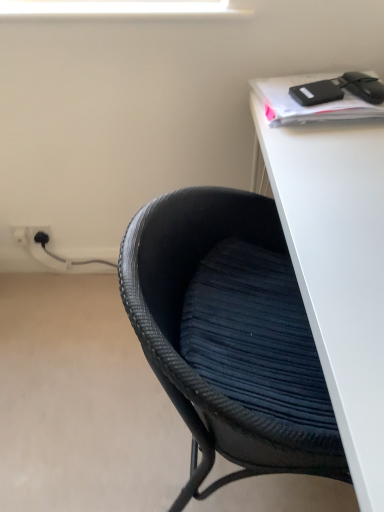
Question: Can you confirm if white plastic electric outlet at lower left, the 2th electric outlet when ordered from right to left, is shorter than white matte desk at upper right?

Choices:
 (A) no
 (B) yes

Answer: (B)

Question: Does white plastic electric outlet at lower left, the 2th electric outlet when ordered from right to left, have a smaller size compared to white matte desk at upper right?

Choices:
 (A) no
 (B) yes

Answer: (B)

Question: Is white plastic electric outlet at lower left, the 2th electric outlet when ordered from right to left, turned away from white matte desk at upper right?

Choices:
 (A) yes
 (B) no

Answer: (B)

Question: Is white plastic electric outlet at lower left, which ranks as the first electric outlet in left-to-right order, completely or partially outside of white matte desk at upper right?

Choices:
 (A) no
 (B) yes

Answer: (B)

Question: From a real-world perspective, is white plastic electric outlet at lower left, which ranks as the first electric outlet in left-to-right order, positioned over white matte desk at upper right based on gravity?

Choices:
 (A) no
 (B) yes

Answer: (A)

Question: Can you confirm if white plastic electric outlet at lower left, the 2th electric outlet when ordered from right to left, is positioned to the left of white matte desk at upper right?

Choices:
 (A) no
 (B) yes

Answer: (B)

Question: Does white plastic electric outlet at lower left, the 2th electric outlet when ordered from left to right, come behind white matte desk at upper right?

Choices:
 (A) no
 (B) yes

Answer: (B)

Question: Are white plastic electric outlet at lower left, which ranks as the first electric outlet in right-to-left order, and white matte desk at upper right beside each other?

Choices:
 (A) yes
 (B) no

Answer: (B)

Question: Is white plastic electric outlet at lower left, which ranks as the first electric outlet in right-to-left order, positioned beyond the bounds of white matte desk at upper right?

Choices:
 (A) no
 (B) yes

Answer: (B)

Question: From a real-world perspective, does white plastic electric outlet at lower left, which ranks as the first electric outlet in right-to-left order, stand above white matte desk at upper right?

Choices:
 (A) yes
 (B) no

Answer: (B)

Question: Does white plastic electric outlet at lower left, which ranks as the first electric outlet in right-to-left order, have a lesser width compared to white matte desk at upper right?

Choices:
 (A) no
 (B) yes

Answer: (B)

Question: Is white plastic electric outlet at lower left, the 2th electric outlet when ordered from left to right, shorter than white matte desk at upper right?

Choices:
 (A) no
 (B) yes

Answer: (B)

Question: From a real-world perspective, is black woven chair at lower left on top of white plastic electric outlet at lower left, the 2th electric outlet when ordered from right to left?

Choices:
 (A) no
 (B) yes

Answer: (B)